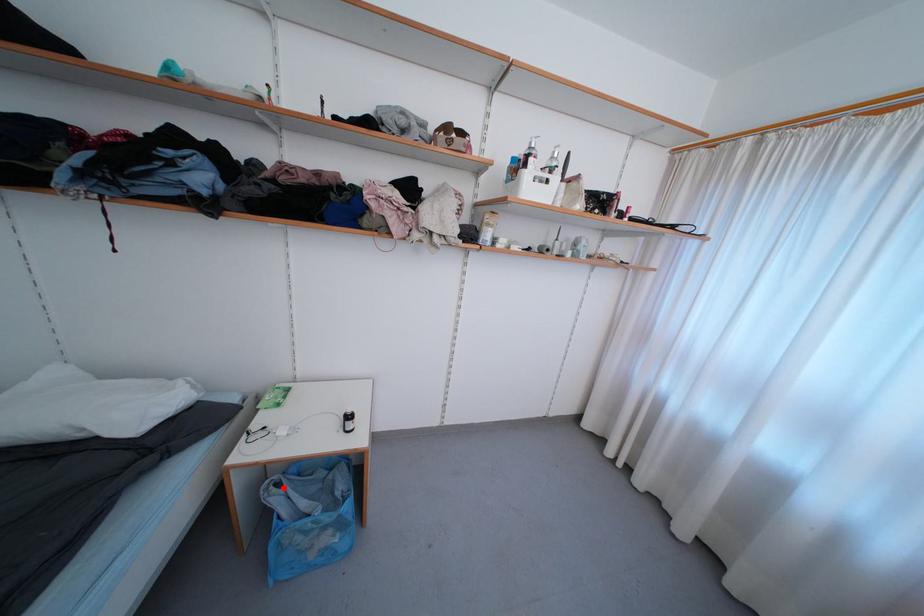
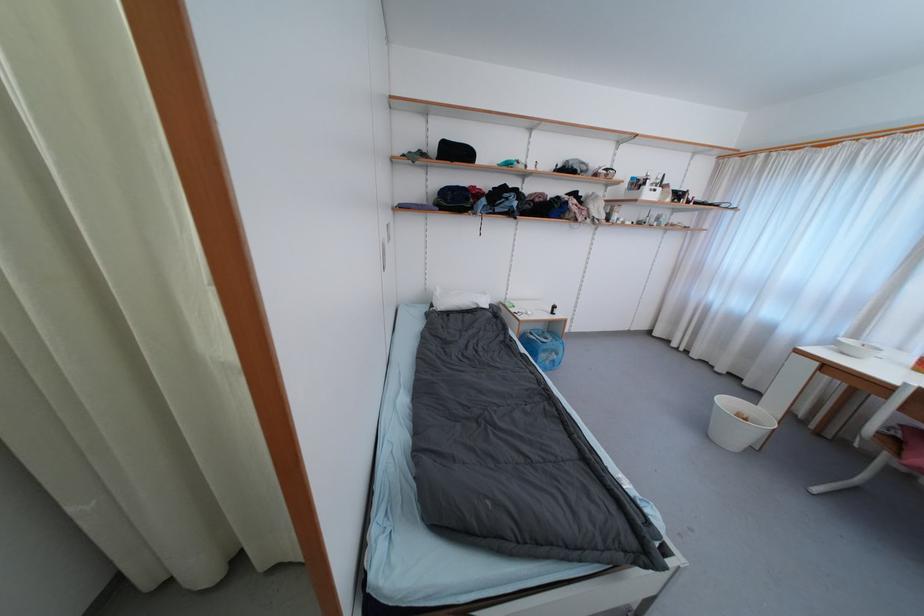
Locate, in the second image, the point that corresponds to the highlighted location in the first image.

(535, 336)